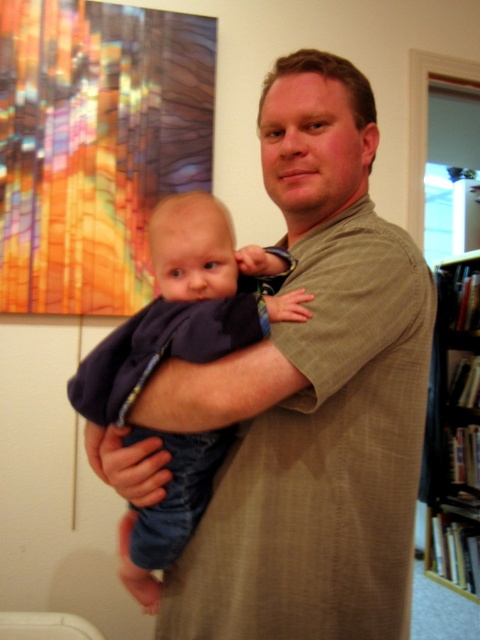
Can you confirm if dark blue fabric at center is positioned above black wood bookshelf at right?

Yes.

Who is taller, dark blue fabric at center or black wood bookshelf at right?

black wood bookshelf at right is taller.

Image resolution: width=480 pixels, height=640 pixels. What do you see at coordinates (188, 305) in the screenshot?
I see `dark blue fabric at center` at bounding box center [188, 305].

I want to click on dark blue fabric at center, so click(188, 305).

Which is above, matte khaki shirt at center or black wood bookshelf at right?

matte khaki shirt at center

Can you confirm if matte khaki shirt at center is positioned below black wood bookshelf at right?

No.

Which is in front, point (264, 544) or point (469, 452)?

Point (264, 544) is in front.

The image size is (480, 640). In order to click on matte khaki shirt at center in this screenshot , I will do `click(312, 397)`.

Does point (276, 67) lie behind point (95, 376)?

Yes, point (276, 67) is farther from viewer.

Locate an element on the screen. This screenshot has width=480, height=640. matte khaki shirt at center is located at coordinates pyautogui.click(x=312, y=397).